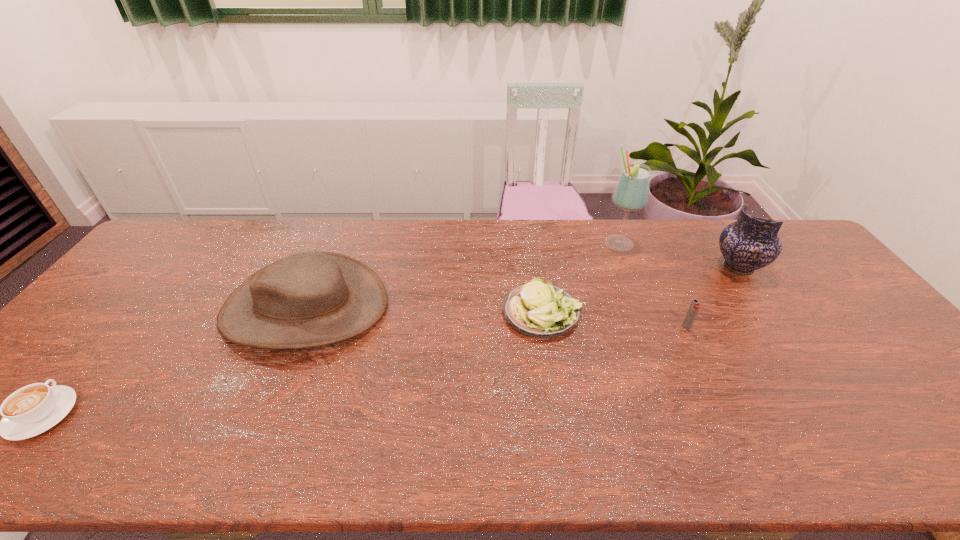
Locate an element on the screen. the fourth object from left to right is located at coordinates (631, 193).

Find the location of a particular element. alcohol is located at coordinates (631, 193).

In order to click on the fifth shortest object in this screenshot , I will do `click(750, 243)`.

The height and width of the screenshot is (540, 960). What are the coordinates of `pottery` in the screenshot? It's located at (750, 243).

Locate an element on the screen. Image resolution: width=960 pixels, height=540 pixels. the fifth object from right to left is located at coordinates (309, 299).

Identify the location of the third tallest object. This screenshot has height=540, width=960. (309, 299).

Identify the location of the second object from right to left. The image size is (960, 540). (694, 307).

Identify the location of the fourth tallest object. The image size is (960, 540). (694, 307).

The width and height of the screenshot is (960, 540). What are the coordinates of `the fourth object from right to left` in the screenshot? It's located at (541, 310).

Where is `lettuce`? This screenshot has width=960, height=540. lettuce is located at coordinates (541, 310).